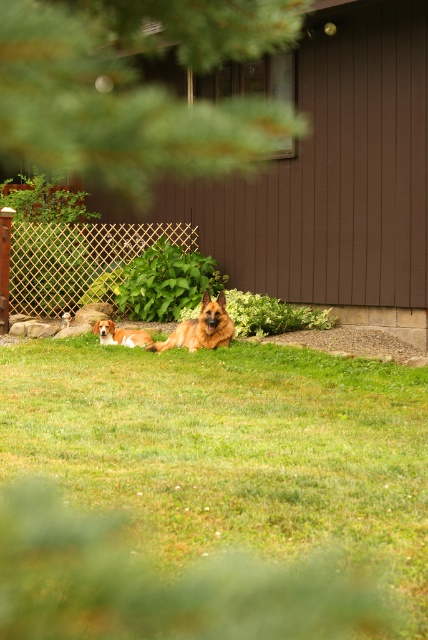
Does green grass at center have a greater width compared to golden fur dog at center?

Yes.

Does point (253, 627) come in front of point (157, 340)?

That is True.

Is point (401, 589) farther from camera compared to point (181, 336)?

No, it is in front of (181, 336).

This screenshot has width=428, height=640. I want to click on green grass at center, so click(x=211, y=493).

From the picture: Who is lower down, golden fur dog at center or light brown fur at lower left?

Positioned lower is light brown fur at lower left.

Does golden fur dog at center come in front of light brown fur at lower left?

Yes, it is.

The image size is (428, 640). What are the coordinates of `golden fur dog at center` in the screenshot? It's located at (201, 326).

Which of these two, green grass at center or light brown fur at lower left, stands shorter?

green grass at center

Based on the photo, who is more forward, (x=190, y=419) or (x=127, y=332)?

Positioned in front is point (x=190, y=419).

Which is in front, point (244, 452) or point (107, 333)?

Positioned in front is point (244, 452).

The height and width of the screenshot is (640, 428). Identify the location of green grass at center. (211, 493).